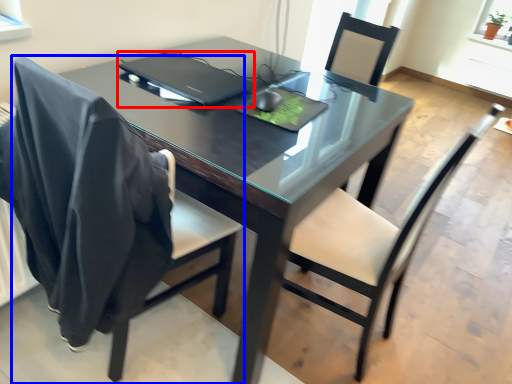
Question: Which object appears closest to the camera in this image, laptop (highlighted by a red box) or chair (highlighted by a blue box)?

Choices:
 (A) laptop
 (B) chair

Answer: (B)